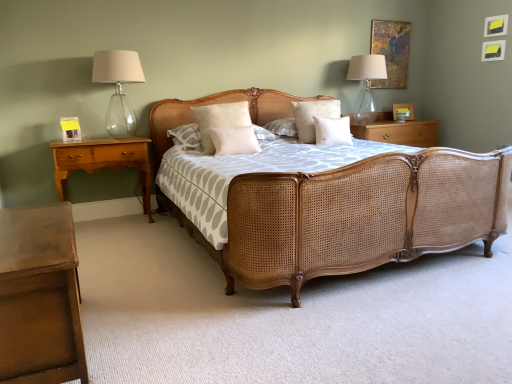
At what (x,y) coordinates should I click in order to perform the action: click on unoccupied region to the right of matte yellow picture frame at left, which is counted as the second picture frame, starting from the top. Please return your answer as a coordinate pair (x, y). Looking at the image, I should click on (97, 140).